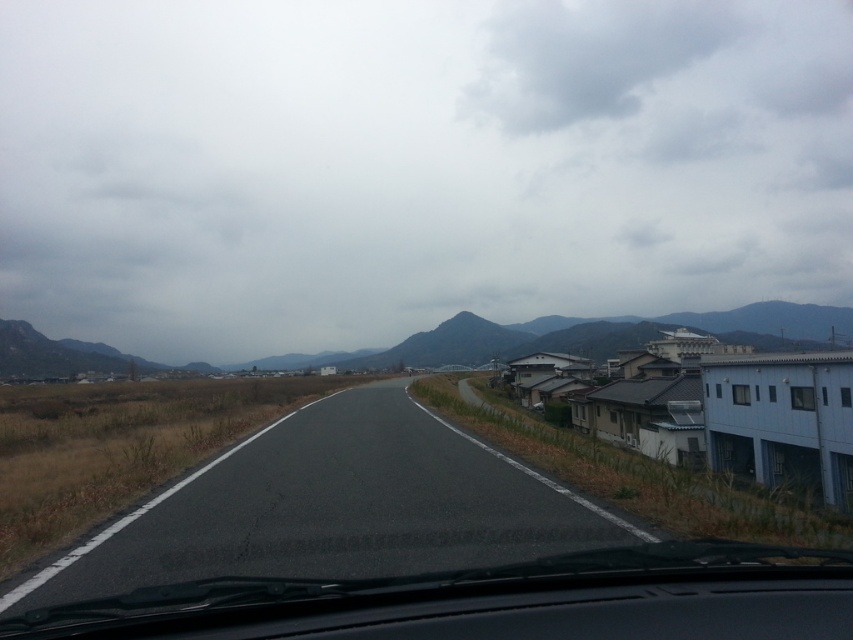
Is asphalt road at center taller than transparent glass windshield at center?

Indeed, asphalt road at center has a greater height compared to transparent glass windshield at center.

Is asphalt road at center closer to camera compared to transparent glass windshield at center?

No, it is behind transparent glass windshield at center.

The image size is (853, 640). What are the coordinates of `asphalt road at center` in the screenshot? It's located at (334, 508).